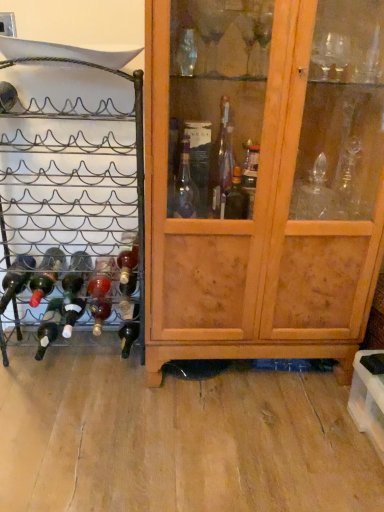
Where is `green matte bottle at lower left, the 4th bottle viewed from the right`? This screenshot has width=384, height=512. green matte bottle at lower left, the 4th bottle viewed from the right is located at coordinates pyautogui.click(x=73, y=302).

Locate an element on the screen. matte black wine bottle at left, which is counted as the first bottle, starting from the left is located at coordinates (16, 278).

In the scene shown: Measure the distance between matte black wine bottle at left, which is counted as the first bottle, starting from the left, and camera.

The depth of matte black wine bottle at left, which is counted as the first bottle, starting from the left, is 4.95 feet.

The width and height of the screenshot is (384, 512). I want to click on matte glass bottle at lower left, positioned as the third bottle in right-to-left order, so click(x=76, y=273).

Identify the location of black metal wine rack at left. The image size is (384, 512). (72, 196).

The width and height of the screenshot is (384, 512). I want to click on translucent glass bottle at center, so click(x=100, y=292).

Measure the distance between matte glass bottle at left, the third bottle in the left-to-right sequence, and camera.

matte glass bottle at left, the third bottle in the left-to-right sequence, is 4.93 feet from camera.

You are a GUI agent. You are given a task and a screenshot of the screen. Output one action in this format:
    pyautogui.click(x=<x>, y=<y>)
    Task: Click on the matte glass bottle at left, the third bottle in the left-to-right sequence
    Image resolution: width=384 pixels, height=512 pixels.
    Given the screenshot: What is the action you would take?
    click(46, 275)

At what (x,y) coordinates should I click in order to perform the action: click on green matte bottle at lower left, the 4th bottle viewed from the right. Please return your answer as a coordinate pair (x, y). This screenshot has width=384, height=512. Looking at the image, I should click on (73, 302).

From a real-world perspective, is matte glass bottle at left, placed as the 5th bottle when sorted from right to left, on top of translucent glass bottle at center?

Correct, in the physical world, matte glass bottle at left, placed as the 5th bottle when sorted from right to left, is higher than translucent glass bottle at center.

Based on their sizes in the image, would you say matte glass bottle at left, the third bottle in the left-to-right sequence, is bigger or smaller than translucent glass bottle at center?

In the image, matte glass bottle at left, the third bottle in the left-to-right sequence, appears to be larger than translucent glass bottle at center.

The height and width of the screenshot is (512, 384). I want to click on bottle that is the 3rd one above the translucent glass bottle at center (from a real-world perspective), so click(46, 275).

Is matte glass bottle at left, placed as the 5th bottle when sorted from right to left, thinner than translucent glass bottle at center?

No.

From the image's perspective, who appears lower, matte glass bottle at lower left, positioned as the third bottle in right-to-left order, or dark glass bottle at lower left, which is the sixth bottle in left-to-right order?

dark glass bottle at lower left, which is the sixth bottle in left-to-right order.

Between matte glass bottle at lower left, positioned as the third bottle in right-to-left order, and dark glass bottle at lower left, which is the sixth bottle in left-to-right order, which one has less height?

matte glass bottle at lower left, positioned as the third bottle in right-to-left order.

How far apart are matte glass bottle at lower left, the 5th bottle when ordered from left to right, and dark glass bottle at lower left, the second bottle in the right-to-left sequence?

They are 25.34 centimeters apart.

Is green matte bottle at lower left, the 4th bottle viewed from the right, oriented away from wooden cabinet at center?

green matte bottle at lower left, the 4th bottle viewed from the right, does not have its back to wooden cabinet at center.

Does green matte bottle at lower left, the 4th bottle viewed from the right, have a greater height compared to wooden cabinet at center?

No.

Which object is closer to the camera, green matte bottle at lower left, the 4th bottle viewed from the right, or wooden cabinet at center?

wooden cabinet at center is closer to the camera.

At what (x,y) coordinates should I click in order to perform the action: click on the 5th bottle directly beneath the wooden cabinet at center (from a real-world perspective). Please return your answer as a coordinate pair (x, y). Image resolution: width=384 pixels, height=512 pixels. Looking at the image, I should click on (73, 302).

Which is more to the right, translucent glass bottle at center, acting as the 7th bottle starting from the left, or green matte bottle at lower left, the 4th bottle viewed from the right?

translucent glass bottle at center, acting as the 7th bottle starting from the left, is more to the right.

Can you confirm if translucent glass bottle at center, which is the first bottle from right to left, is smaller than green matte bottle at lower left, the fourth bottle viewed from the left?

Yes, translucent glass bottle at center, which is the first bottle from right to left, is smaller than green matte bottle at lower left, the fourth bottle viewed from the left.

Is point (123, 247) closer to viewer compared to point (74, 323)?

No.

Based on the photo, which of these two, translucent glass bottle at center, which is the first bottle from right to left, or green matte bottle at lower left, the fourth bottle viewed from the left, stands shorter?

Result: With less height is translucent glass bottle at center, which is the first bottle from right to left.

Is point (49, 305) positioned after point (122, 266)?

That is False.

Between matte dark brown bottle at lower left, the second bottle when ordered from left to right, and translucent glass bottle at center, which is the first bottle from right to left, which one has larger size?

With larger size is matte dark brown bottle at lower left, the second bottle when ordered from left to right.

Is matte dark brown bottle at lower left, which is the sixth bottle from right to left, to the right of translucent glass bottle at center, acting as the 7th bottle starting from the left, from the viewer's perspective?

No.

Based on the photo, from the image's perspective, relative to translucent glass bottle at center, acting as the 7th bottle starting from the left, is matte dark brown bottle at lower left, the second bottle when ordered from left to right, above or below?

Based on their image positions, matte dark brown bottle at lower left, the second bottle when ordered from left to right, is located beneath translucent glass bottle at center, acting as the 7th bottle starting from the left.

Does dark glass bottle at lower left, which is the sixth bottle in left-to-right order, appear on the left side of matte black wine bottle at left, which is counted as the first bottle, starting from the left?

In fact, dark glass bottle at lower left, which is the sixth bottle in left-to-right order, is to the right of matte black wine bottle at left, which is counted as the first bottle, starting from the left.

From a real-world perspective, who is located lower, dark glass bottle at lower left, which is the sixth bottle in left-to-right order, or matte black wine bottle at left, positioned as the seventh bottle in right-to-left order?

In real-world perspective, dark glass bottle at lower left, which is the sixth bottle in left-to-right order, is lower.

Is dark glass bottle at lower left, the second bottle in the right-to-left sequence, shorter than matte black wine bottle at left, which is counted as the first bottle, starting from the left?

No.

Looking at this image, from a real-world perspective, does green matte bottle at lower left, the 4th bottle viewed from the right, stand above matte glass bottle at lower left, the 5th bottle when ordered from left to right?

No, from a real-world perspective, green matte bottle at lower left, the 4th bottle viewed from the right, is not over matte glass bottle at lower left, the 5th bottle when ordered from left to right

Is green matte bottle at lower left, the fourth bottle viewed from the left, to the right of matte glass bottle at lower left, the 5th bottle when ordered from left to right, from the viewer's perspective?

In fact, green matte bottle at lower left, the fourth bottle viewed from the left, is to the left of matte glass bottle at lower left, the 5th bottle when ordered from left to right.

Is green matte bottle at lower left, the fourth bottle viewed from the left, bigger or smaller than matte glass bottle at lower left, positioned as the third bottle in right-to-left order?

In the image, green matte bottle at lower left, the fourth bottle viewed from the left, appears to be larger than matte glass bottle at lower left, positioned as the third bottle in right-to-left order.

The image size is (384, 512). There is a matte glass bottle at lower left, the 5th bottle when ordered from left to right. Find the location of `the 1st bottle below it (from a real-world perspective)`. the 1st bottle below it (from a real-world perspective) is located at coordinates (73, 302).

In order to click on glass bottle lying behind the matte glass bottle at left, placed as the 5th bottle when sorted from right to left in this screenshot , I will do `click(100, 292)`.

From the image's perspective, starting from the dark glass bottle at lower left, the second bottle in the right-to-left sequence, which bottle is the 3rd one above? Please provide its 2D coordinates.

[(76, 273)]

When comparing their distances from matte dark brown bottle at lower left, which is the sixth bottle from right to left, does black metal wine rack at left or translucent glass bottle at center, acting as the 7th bottle starting from the left, seem further?

black metal wine rack at left is positioned further to the anchor matte dark brown bottle at lower left, which is the sixth bottle from right to left.

Which object lies further to the anchor point green matte bottle at lower left, the 4th bottle viewed from the right, matte dark brown bottle at lower left, the second bottle when ordered from left to right, or wooden cabinet at center?

Based on the image, wooden cabinet at center appears to be further to green matte bottle at lower left, the 4th bottle viewed from the right.

From the picture: Considering their positions, is black metal wine rack at left positioned closer to matte black wine bottle at left, which is counted as the first bottle, starting from the left, than dark glass bottle at lower left, which is the sixth bottle in left-to-right order?

black metal wine rack at left is positioned closer to the anchor matte black wine bottle at left, which is counted as the first bottle, starting from the left.

Which object lies nearer to the anchor point black metal wine rack at left, matte glass bottle at lower left, the 5th bottle when ordered from left to right, or translucent glass bottle at center, which is the first bottle from right to left?

The object closer to black metal wine rack at left is matte glass bottle at lower left, the 5th bottle when ordered from left to right.

From the image, which object appears to be farther from translucent glass bottle at center, which is the first bottle from right to left, matte black wine bottle at left, which is counted as the first bottle, starting from the left, or black metal wine rack at left?

matte black wine bottle at left, which is counted as the first bottle, starting from the left, lies further to translucent glass bottle at center, which is the first bottle from right to left, than the other object.

When comparing their distances from matte glass bottle at left, the third bottle in the left-to-right sequence, does matte dark brown bottle at lower left, the second bottle when ordered from left to right, or wooden cabinet at center seem closer?

Based on the image, matte dark brown bottle at lower left, the second bottle when ordered from left to right, appears to be nearer to matte glass bottle at left, the third bottle in the left-to-right sequence.

Which object lies further to the anchor point matte dark brown bottle at lower left, the second bottle when ordered from left to right, matte glass bottle at lower left, the 5th bottle when ordered from left to right, or dark glass bottle at lower left, which is the sixth bottle in left-to-right order?

dark glass bottle at lower left, which is the sixth bottle in left-to-right order, is positioned further to the anchor matte dark brown bottle at lower left, the second bottle when ordered from left to right.

From the image, which object appears to be farther from matte dark brown bottle at lower left, which is the sixth bottle from right to left, dark glass bottle at lower left, which is the sixth bottle in left-to-right order, or matte black wine bottle at left, which is counted as the first bottle, starting from the left?

dark glass bottle at lower left, which is the sixth bottle in left-to-right order, lies further to matte dark brown bottle at lower left, which is the sixth bottle from right to left, than the other object.

Locate an element on the screen. The width and height of the screenshot is (384, 512). glass bottle between matte dark brown bottle at lower left, the second bottle when ordered from left to right, and translucent glass bottle at center, acting as the 7th bottle starting from the left is located at coordinates (100, 292).

At what (x,y) coordinates should I click in order to perform the action: click on glass bottle between green matte bottle at lower left, the fourth bottle viewed from the left, and dark glass bottle at lower left, which is the sixth bottle in left-to-right order. Please return your answer as a coordinate pair (x, y). Looking at the image, I should click on (100, 292).

The image size is (384, 512). Find the location of `glass bottle situated between green matte bottle at lower left, the 4th bottle viewed from the right, and wooden cabinet at center from left to right`. glass bottle situated between green matte bottle at lower left, the 4th bottle viewed from the right, and wooden cabinet at center from left to right is located at coordinates (100, 292).

At what (x,y) coordinates should I click in order to perform the action: click on glass bottle between matte glass bottle at lower left, the 5th bottle when ordered from left to right, and matte dark brown bottle at lower left, which is the sixth bottle from right to left, from top to bottom. Please return your answer as a coordinate pair (x, y). Image resolution: width=384 pixels, height=512 pixels. Looking at the image, I should click on (100, 292).